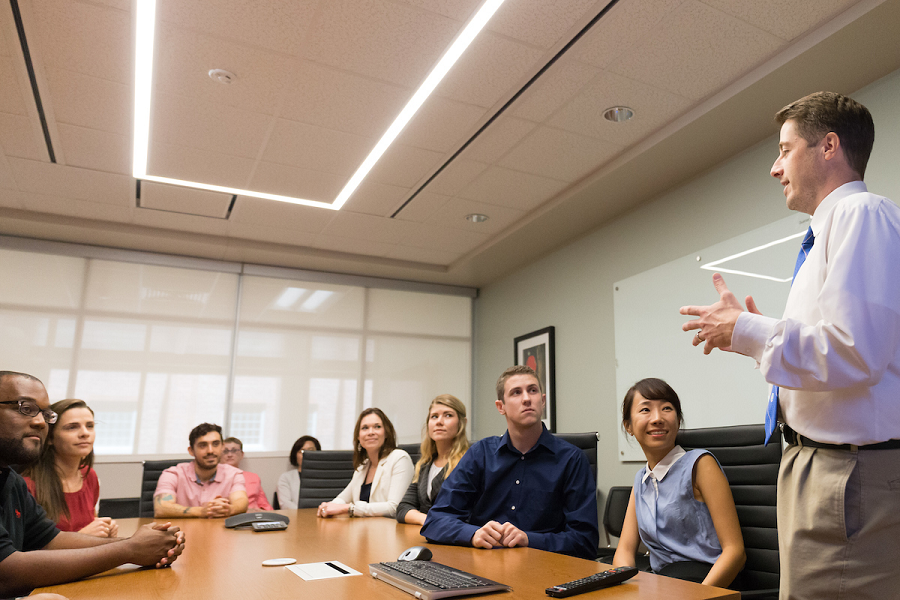
This screenshot has width=900, height=600. What are the coordinates of `chairs` in the screenshot? It's located at (157, 466), (127, 505), (340, 460), (577, 433), (622, 511), (741, 442).